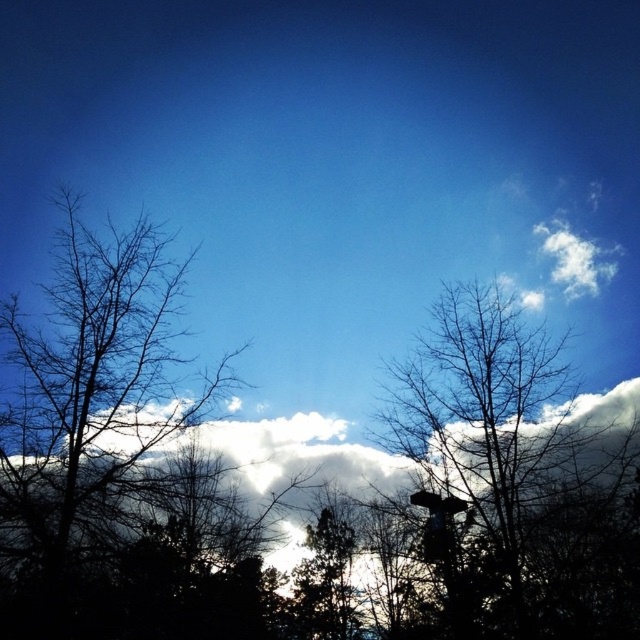
In the scene shown: You are an artist trying to paint the scene. You want to ensure the black bare tree at left is proportionally accurate compared to the bare branches at center. Which one should you draw taller?

The bare branches at center should be drawn taller because the black bare tree at left is shorter than the bare branches at center according to the description.

You are standing at the center of the image and want to walk towards the black bare tree at left. In which direction should you head?

The black bare tree at left is located at point 0.613 on the x and 0.145 on the y axis. Since you are at the center, you should move towards the left and slightly downward to reach it.

You are an observer looking at the sky scene. You notice the black bare tree at left and the bare branches at center. Which one is positioned more to the left side of the image?

The black bare tree at left is positioned more to the left side of the image than the bare branches at center.